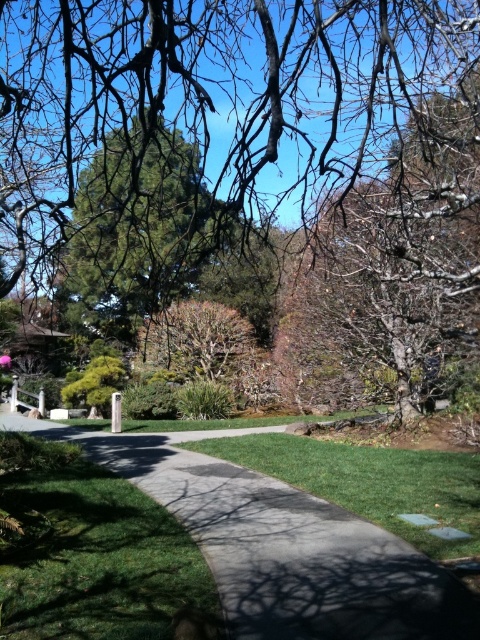
Question: Which point is farther from the camera taking this photo?

Choices:
 (A) (382, 566)
 (B) (192, 544)

Answer: (B)

Question: Which of these objects is positioned closest to the green grass at center?

Choices:
 (A) gray concrete pavement at center
 (B) green grass at lower left

Answer: (A)

Question: Can you confirm if green grass at lower left is thinner than green grass at center?

Choices:
 (A) no
 (B) yes

Answer: (A)

Question: Among these points, which one is nearest to the camera?

Choices:
 (A) (197, 550)
 (B) (364, 620)
 (C) (439, 492)

Answer: (B)

Question: Is green grass at lower left to the right of green grass at center from the viewer's perspective?

Choices:
 (A) yes
 (B) no

Answer: (B)

Question: Does green grass at lower left appear on the right side of green grass at center?

Choices:
 (A) yes
 (B) no

Answer: (B)